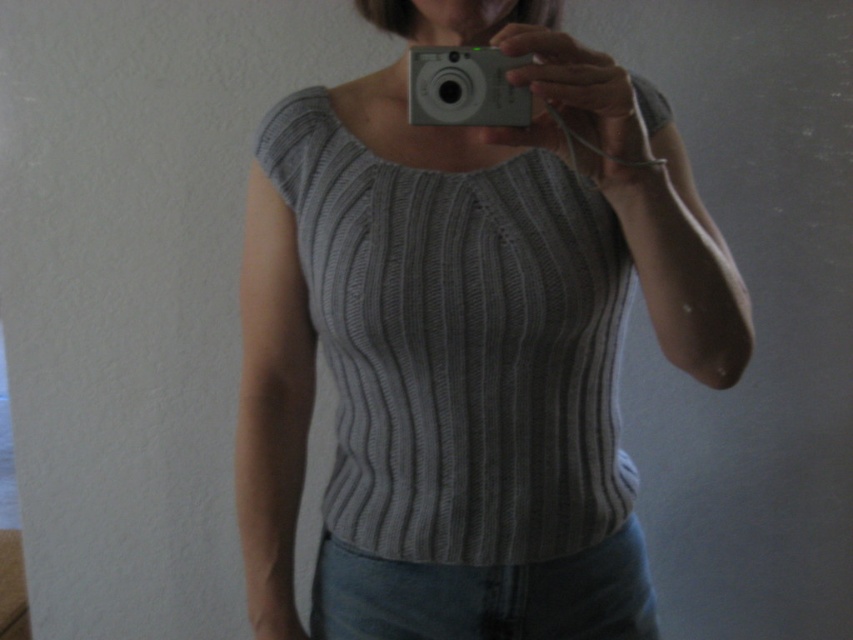
Is gray ribbed knit top at center above white plastic camera at upper center?

Actually, gray ribbed knit top at center is below white plastic camera at upper center.

Looking at this image, who is more distant from viewer, (379, 115) or (486, 77)?

Positioned behind is point (379, 115).

Identify the location of gray ribbed knit top at center. The width and height of the screenshot is (853, 640). point(466,340).